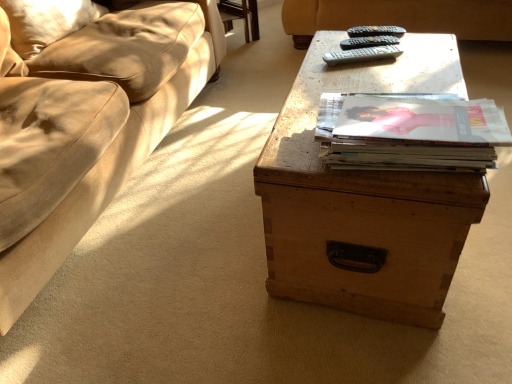
Question: Does black plastic remote at upper center, the 1th remote in the top-to-bottom sequence, turn towards black plastic remote at upper center, arranged as the 2th remote when viewed from the top?

Choices:
 (A) no
 (B) yes

Answer: (A)

Question: From the image's perspective, is black plastic remote at upper center, the third remote positioned from the bottom, over black plastic remote at upper center, arranged as the 2th remote when viewed from the top?

Choices:
 (A) no
 (B) yes

Answer: (B)

Question: Are black plastic remote at upper center, the 1th remote in the top-to-bottom sequence, and black plastic remote at upper center, the second remote when ordered from bottom to top, located far from each other?

Choices:
 (A) no
 (B) yes

Answer: (A)

Question: Can you confirm if black plastic remote at upper center, the 1th remote in the top-to-bottom sequence, is positioned to the left of black plastic remote at upper center, arranged as the 2th remote when viewed from the top?

Choices:
 (A) no
 (B) yes

Answer: (A)

Question: Considering the relative sizes of black plastic remote at upper center, the 1th remote in the top-to-bottom sequence, and black plastic remote at upper center, the second remote when ordered from bottom to top, in the image provided, is black plastic remote at upper center, the 1th remote in the top-to-bottom sequence, bigger than black plastic remote at upper center, the second remote when ordered from bottom to top,?

Choices:
 (A) no
 (B) yes

Answer: (A)

Question: Can you confirm if black plastic remote at upper center, the third remote positioned from the bottom, is taller than black plastic remote at upper center, arranged as the 2th remote when viewed from the top?

Choices:
 (A) no
 (B) yes

Answer: (B)

Question: Is black plastic remote at upper center, arranged as the 2th remote when viewed from the top, placed right next to matte paper stack of magazines at center?

Choices:
 (A) yes
 (B) no

Answer: (B)

Question: Is black plastic remote at upper center, the second remote when ordered from bottom to top, facing towards matte paper stack of magazines at center?

Choices:
 (A) no
 (B) yes

Answer: (A)

Question: Considering the relative sizes of black plastic remote at upper center, the second remote when ordered from bottom to top, and matte paper stack of magazines at center in the image provided, is black plastic remote at upper center, the second remote when ordered from bottom to top, thinner than matte paper stack of magazines at center?

Choices:
 (A) no
 (B) yes

Answer: (B)

Question: Considering the relative sizes of black plastic remote at upper center, the second remote when ordered from bottom to top, and matte paper stack of magazines at center in the image provided, is black plastic remote at upper center, the second remote when ordered from bottom to top, shorter than matte paper stack of magazines at center?

Choices:
 (A) no
 (B) yes

Answer: (B)

Question: From the image's perspective, is black plastic remote at upper center, arranged as the 2th remote when viewed from the top, located above matte paper stack of magazines at center?

Choices:
 (A) yes
 (B) no

Answer: (A)

Question: From a real-world perspective, is black plastic remote at upper center, arranged as the 2th remote when viewed from the top, below matte paper stack of magazines at center?

Choices:
 (A) yes
 (B) no

Answer: (A)

Question: Does suede-like beige pillow at upper left lie in front of wooden trunk at center?

Choices:
 (A) no
 (B) yes

Answer: (A)